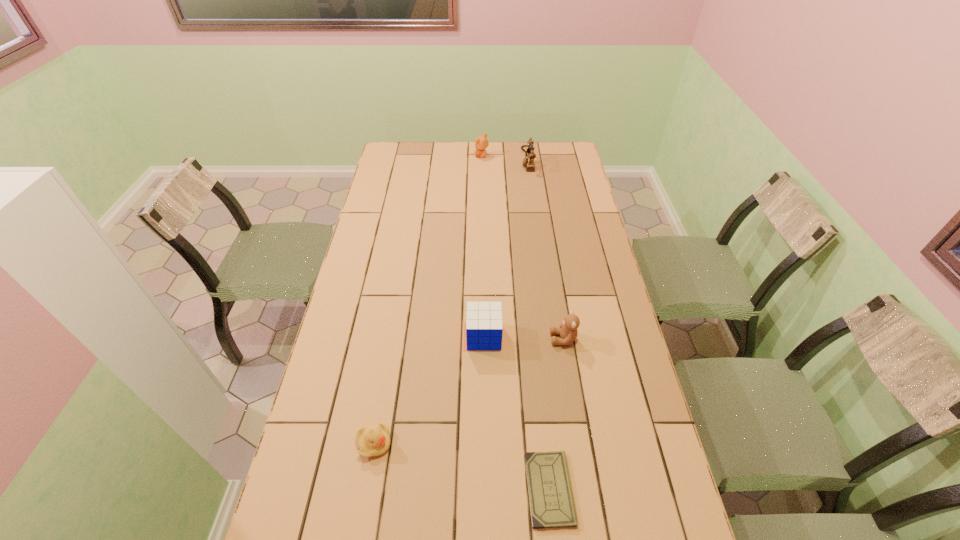
Locate an element on the screen. The height and width of the screenshot is (540, 960). teddy bear located in the far edge section of the desktop is located at coordinates 481,142.

Identify the location of object located at the left edge. This screenshot has height=540, width=960. (372, 440).

At what (x,y) coordinates should I click in order to perform the action: click on object that is at the right edge. Please return your answer as a coordinate pair (x, y). The image size is (960, 540). Looking at the image, I should click on (568, 332).

At what (x,y) coordinates should I click in order to perform the action: click on vacant area at the far edge. Please return your answer as a coordinate pair (x, y). The image size is (960, 540). Looking at the image, I should click on (x=495, y=143).

Where is `free space at the left edge of the desktop`? free space at the left edge of the desktop is located at coordinates (293, 509).

Locate an element on the screen. free space at the right edge is located at coordinates (610, 458).

Image resolution: width=960 pixels, height=540 pixels. Identify the location of blank space at the far right corner of the desktop. (561, 148).

Where is `free area in between the checkbook and the right teddy bear`? This screenshot has height=540, width=960. free area in between the checkbook and the right teddy bear is located at coordinates (557, 414).

Locate an element on the screen. The height and width of the screenshot is (540, 960). vacant area that lies between the leftmost object and the cube is located at coordinates (429, 390).

Where is `vacant area between the cube and the right teddy bear`? vacant area between the cube and the right teddy bear is located at coordinates [524, 338].